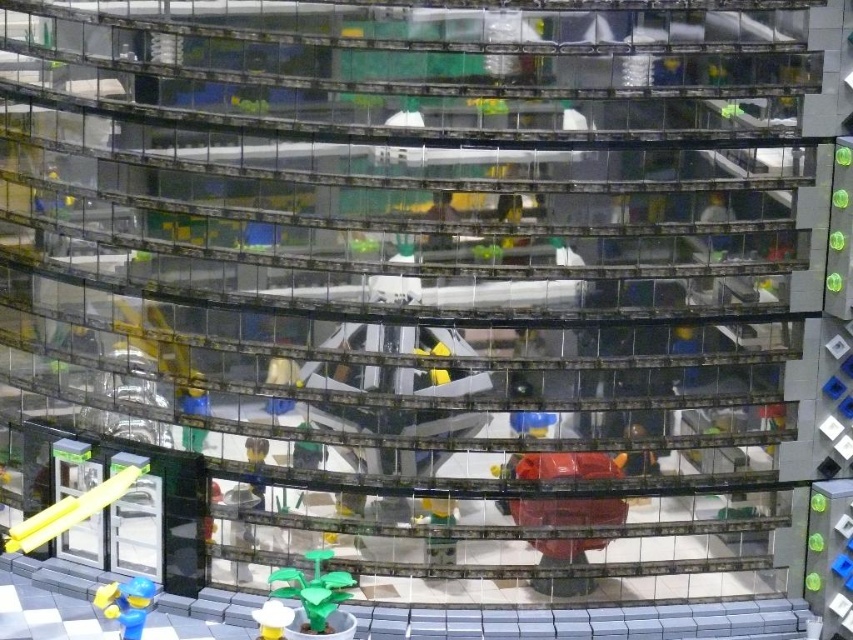
Question: Among these points, which one is farthest from the camera?

Choices:
 (A) (318, 608)
 (B) (97, 589)
 (C) (447, 522)
 (D) (286, 625)

Answer: (B)

Question: Does shiny red fire hydrant at center come in front of white plastic cup at lower center?

Choices:
 (A) no
 (B) yes

Answer: (A)

Question: Is shiny red fire hydrant at center to the right of blue plastic figure at lower left from the viewer's perspective?

Choices:
 (A) yes
 (B) no

Answer: (A)

Question: Based on their relative distances, which object is nearer to the green matte plant at lower center?

Choices:
 (A) white plastic cup at lower center
 (B) blue plastic figure at lower left
 (C) smooth plastic cup at center
 (D) shiny red fire hydrant at center

Answer: (A)

Question: Based on their relative distances, which object is farther from the blue plastic figure at lower left?

Choices:
 (A) shiny red fire hydrant at center
 (B) green matte plant at lower center
 (C) smooth plastic cup at center

Answer: (A)

Question: Does green matte plant at lower center come in front of blue plastic figure at lower left?

Choices:
 (A) yes
 (B) no

Answer: (B)